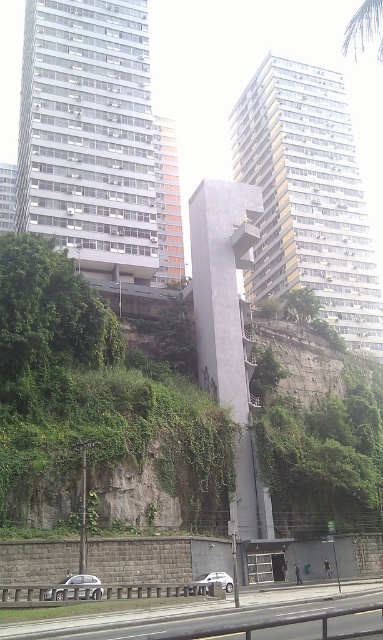
Question: Is the position of silver metallic car at lower center less distant than that of white matte car at center?

Choices:
 (A) yes
 (B) no

Answer: (A)

Question: Which is farther from the white matte car at center?

Choices:
 (A) smooth asphalt highway at lower center
 (B) silver metallic car at lower center
 (C) green leafy vegetation at center

Answer: (C)

Question: Which is nearer to the smooth asphalt highway at lower center?

Choices:
 (A) white matte car at center
 (B) green leafy vegetation at center
 (C) silver metallic car at lower center

Answer: (C)

Question: Which object is positioned closest to the silver metallic car at lower center?

Choices:
 (A) smooth asphalt highway at lower center
 (B) green leafy vegetation at center

Answer: (A)

Question: Where is smooth asphalt highway at lower center located in relation to silver metallic car at lower center in the image?

Choices:
 (A) left
 (B) right

Answer: (B)

Question: In this image, where is green leafy vegetation at center located relative to white matte car at center?

Choices:
 (A) right
 (B) left

Answer: (B)